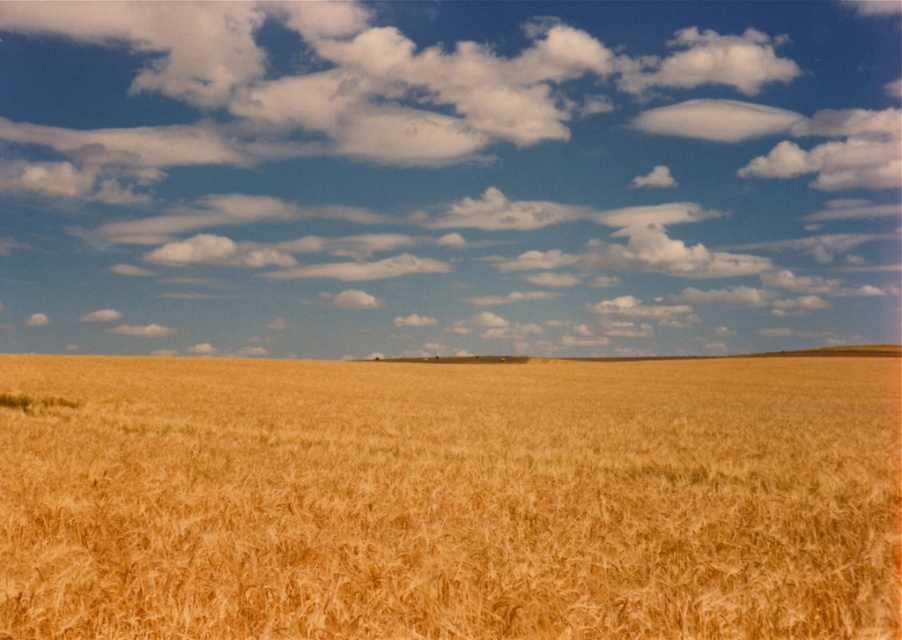
Question: Is the position of white fluffy cloud at upper center more distant than that of golden matte wheat field at center?

Choices:
 (A) no
 (B) yes

Answer: (B)

Question: Which point is closer to the camera taking this photo?

Choices:
 (A) (399, 456)
 (B) (35, 280)

Answer: (A)

Question: Does white fluffy cloud at upper center come in front of golden matte wheat field at center?

Choices:
 (A) no
 (B) yes

Answer: (A)

Question: Among these objects, which one is nearest to the camera?

Choices:
 (A) golden matte wheat field at center
 (B) white fluffy cloud at upper center

Answer: (A)

Question: Which of the following is the farthest from the observer?

Choices:
 (A) (426, 486)
 (B) (79, 138)

Answer: (B)

Question: In this image, where is white fluffy cloud at upper center located relative to golden matte wheat field at center?

Choices:
 (A) below
 (B) above

Answer: (B)